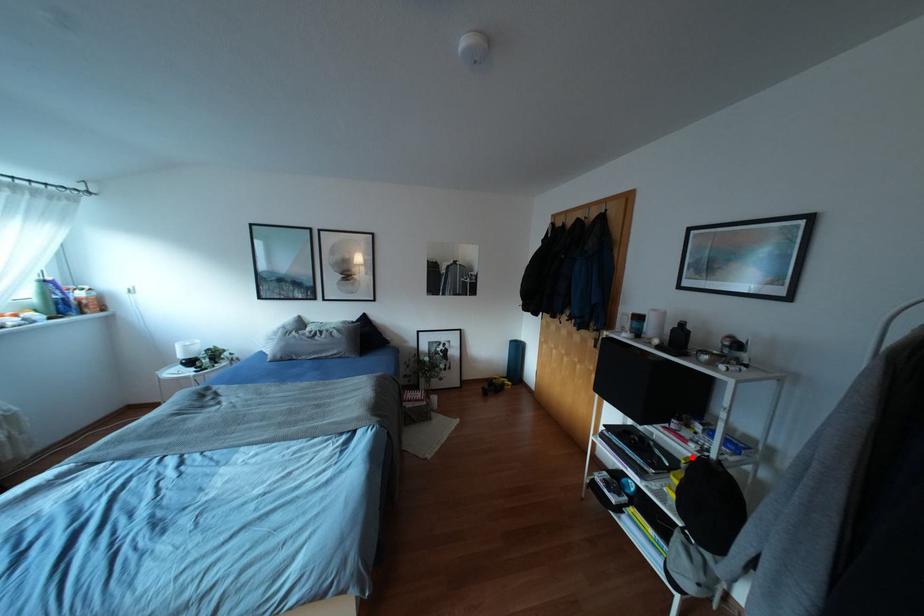
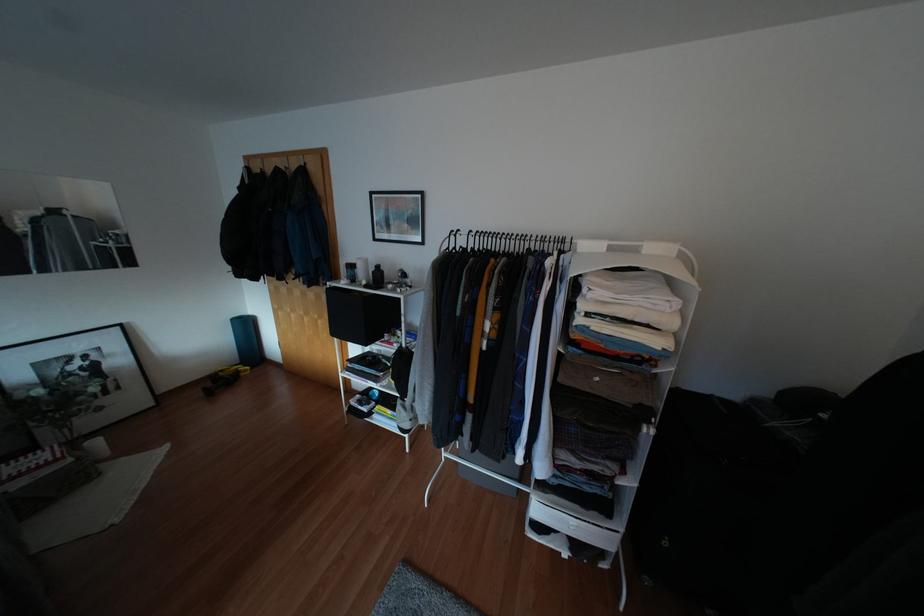
Question: I am providing you with two images of the same scene from different viewpoints. Given a red point in image1, look at the same physical point in image2. Is it:

Choices:
 (A) Closer to the viewpoint
 (B) Farther from the viewpoint

Answer: (B)